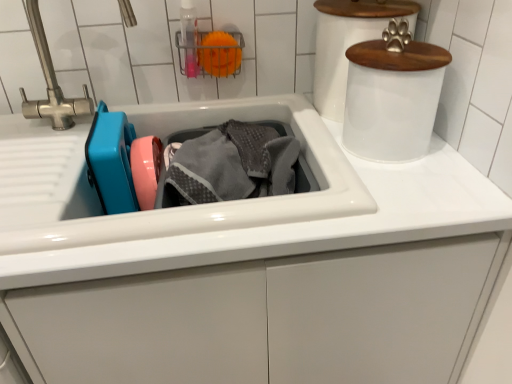
Question: Considering the relative sizes of white glossy sink at center and transparent plastic bottle at upper center in the image provided, is white glossy sink at center smaller than transparent plastic bottle at upper center?

Choices:
 (A) yes
 (B) no

Answer: (B)

Question: Considering the relative sizes of white glossy sink at center and transparent plastic bottle at upper center in the image provided, is white glossy sink at center wider than transparent plastic bottle at upper center?

Choices:
 (A) no
 (B) yes

Answer: (B)

Question: Does white glossy sink at center contain transparent plastic bottle at upper center?

Choices:
 (A) no
 (B) yes

Answer: (A)

Question: Is white glossy sink at center oriented away from transparent plastic bottle at upper center?

Choices:
 (A) no
 (B) yes

Answer: (A)

Question: From the image's perspective, is white glossy sink at center beneath transparent plastic bottle at upper center?

Choices:
 (A) no
 (B) yes

Answer: (B)

Question: Is white glossy sink at center next to transparent plastic bottle at upper center?

Choices:
 (A) yes
 (B) no

Answer: (B)

Question: Considering the relative sizes of white frosted plastic canister at upper right, the first appliance from the front, and white glossy paw print at upper right, placed as the 1th appliance when sorted from back to front, in the image provided, is white frosted plastic canister at upper right, the first appliance from the front, thinner than white glossy paw print at upper right, placed as the 1th appliance when sorted from back to front,?

Choices:
 (A) yes
 (B) no

Answer: (A)

Question: Is white frosted plastic canister at upper right, the first appliance from the front, to the left of white glossy paw print at upper right, placed as the 1th appliance when sorted from back to front, from the viewer's perspective?

Choices:
 (A) no
 (B) yes

Answer: (A)

Question: Would you consider white frosted plastic canister at upper right, which ranks as the second appliance in back-to-front order, to be distant from white glossy paw print at upper right, placed as the 1th appliance when sorted from back to front?

Choices:
 (A) no
 (B) yes

Answer: (A)

Question: Is white frosted plastic canister at upper right, which ranks as the second appliance in back-to-front order, shorter than white glossy paw print at upper right, placed as the 1th appliance when sorted from back to front?

Choices:
 (A) yes
 (B) no

Answer: (A)

Question: From the image's perspective, is white frosted plastic canister at upper right, the first appliance from the front, beneath white glossy paw print at upper right, placed as the 1th appliance when sorted from back to front?

Choices:
 (A) yes
 (B) no

Answer: (A)

Question: Does white frosted plastic canister at upper right, the first appliance from the front, come in front of white glossy paw print at upper right, which ranks as the 2th appliance in front-to-back order?

Choices:
 (A) yes
 (B) no

Answer: (A)

Question: From the image's perspective, is white frosted plastic canister at upper right, which ranks as the second appliance in back-to-front order, over gray terry towel at center?

Choices:
 (A) no
 (B) yes

Answer: (B)